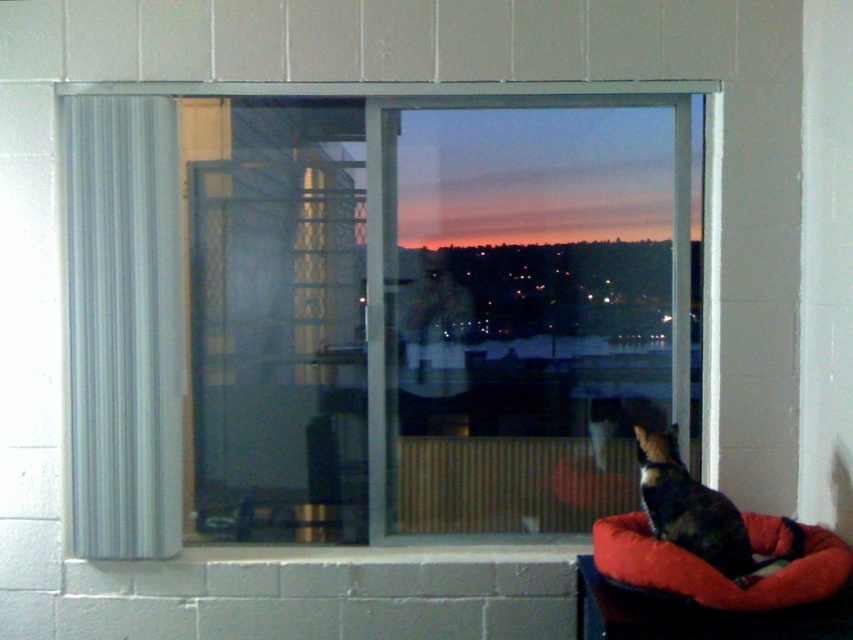
You are standing in the room and looking at the window. There are two points marked on the window, one at coordinates point (80,371) and the other at point (816,573). Which point is closer to you?

Point (80,371) is closer to you because it is further to the viewer than point (816,573).

You are standing in the room and want to touch both points on the window. Which point should you reach for first, the point at coordinate (341, 474) or the point at (631, 547)?

You should reach for the point at coordinate (341, 474) first because it is closer to you than the point at (631, 547).

You are a photographer wanting to capture the sunset through the transparent glass window at center while also including the calico fur cat at lower right in the frame. Given their size difference, will the cat be entirely visible in the photo if the window takes up most of the frame?

The transparent glass window at center is larger in size than calico fur cat at lower right, so if the window occupies most of the frame, there should still be enough space to include the calico fur cat at lower right in the photo as it is smaller in size.